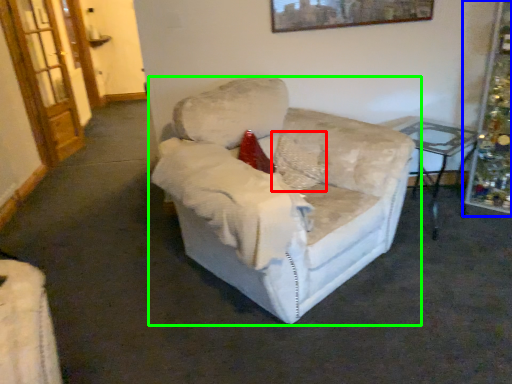
Question: Which object is positioned farthest from pillow (highlighted by a red box)? Select from christmas decoration (highlighted by a blue box) and chair (highlighted by a green box).

Choices:
 (A) christmas decoration
 (B) chair

Answer: (A)